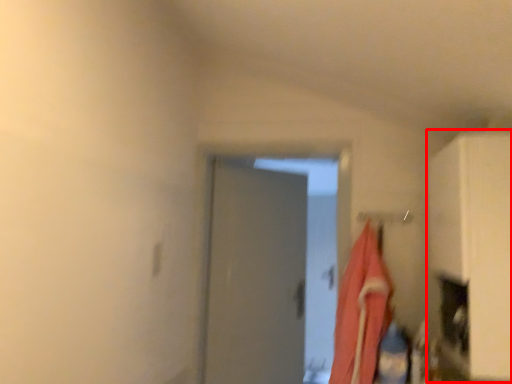
Question: In this image, where is cabinetry (annotated by the red box) located relative to laundry?

Choices:
 (A) right
 (B) left

Answer: (A)